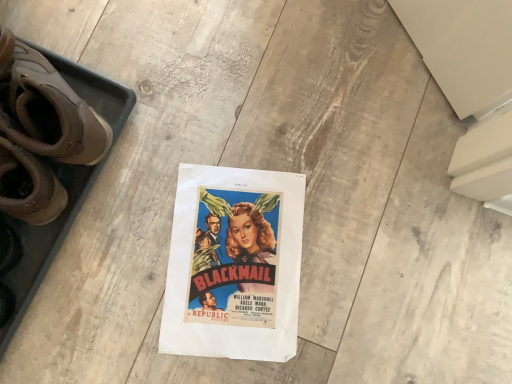
Question: From the image's perspective, does matte paper poster at center appear lower than brown leather boots at left?

Choices:
 (A) no
 (B) yes

Answer: (B)

Question: Could you tell me if matte paper poster at center is turned towards brown leather boots at left?

Choices:
 (A) no
 (B) yes

Answer: (A)

Question: Is matte paper poster at center located outside brown leather boots at left?

Choices:
 (A) no
 (B) yes

Answer: (B)

Question: From the image's perspective, is matte paper poster at center over brown leather boots at left?

Choices:
 (A) yes
 (B) no

Answer: (B)

Question: Does matte paper poster at center have a lesser width compared to brown leather boots at left?

Choices:
 (A) yes
 (B) no

Answer: (B)

Question: Can you confirm if matte paper poster at center is shorter than brown leather boots at left?

Choices:
 (A) no
 (B) yes

Answer: (B)

Question: Is brown leather boots at left not within matte paper poster at center?

Choices:
 (A) no
 (B) yes

Answer: (B)

Question: Can you confirm if brown leather boots at left is thinner than matte paper poster at center?

Choices:
 (A) yes
 (B) no

Answer: (A)

Question: Considering the relative positions of brown leather boots at left and matte paper poster at center in the image provided, is brown leather boots at left to the left of matte paper poster at center from the viewer's perspective?

Choices:
 (A) yes
 (B) no

Answer: (A)

Question: Considering the relative positions of brown leather boots at left and matte paper poster at center in the image provided, is brown leather boots at left in front of matte paper poster at center?

Choices:
 (A) yes
 (B) no

Answer: (A)

Question: From a real-world perspective, is brown leather boots at left beneath matte paper poster at center?

Choices:
 (A) yes
 (B) no

Answer: (B)

Question: From the image's perspective, does brown leather boots at left appear lower than matte paper poster at center?

Choices:
 (A) yes
 (B) no

Answer: (B)

Question: In terms of size, does brown leather boots at left appear bigger or smaller than matte paper poster at center?

Choices:
 (A) big
 (B) small

Answer: (A)